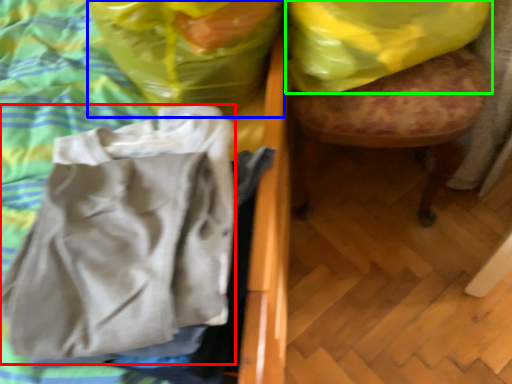
Question: Which object is positioned farthest from wrap (highlighted by a red box)? Select from plastic bag (highlighted by a blue box) and plastic bag (highlighted by a green box).

Choices:
 (A) plastic bag
 (B) plastic bag

Answer: (B)